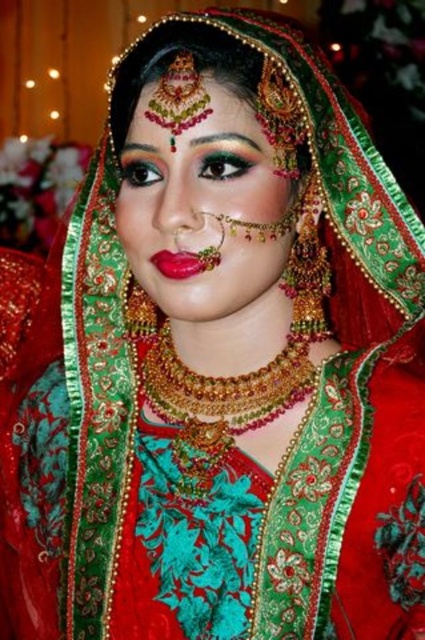
You are a photographer preparing for a closeup shot of the bride. You need to adjust the lighting so that both the matte gold jewelry at center and the shiny red lipstick at center are clearly visible. Which object should you focus on first to ensure proper exposure?

The matte gold jewelry at center is taller than the shiny red lipstick at center, so you should focus on the matte gold jewelry at center first to ensure proper exposure.

You are a photographer taking a portrait of the bride. You notice the matte gold jewelry at center and the shiny red lipstick at center. Which object is positioned to the right of the other?

The matte gold jewelry at center is to the right of shiny red lipstick at center.

You are a photographer preparing to take a closeup shot of the bride. You notice the matte gold jewelry at center and the shiny red lipstick at center. Which object should you focus on first if you want to capture both in the same frame without moving the camera?

The matte gold jewelry at center is above the shiny red lipstick at center, so you should focus on the matte gold jewelry at center first to ensure both are in the frame.